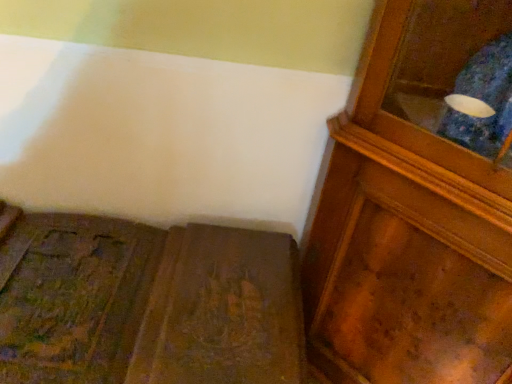
Question: Based on their positions, is wooden cabinet at right located to the left or right of wooden carved bench at lower left?

Choices:
 (A) left
 (B) right

Answer: (B)

Question: Relative to wooden carved bench at lower left, is wooden cabinet at right in front or behind?

Choices:
 (A) front
 (B) behind

Answer: (A)

Question: Is wooden cabinet at right spatially inside wooden carved bench at lower left, or outside of it?

Choices:
 (A) outside
 (B) inside

Answer: (A)

Question: From a real-world perspective, is wooden carved bench at lower left above or below wooden cabinet at right?

Choices:
 (A) above
 (B) below

Answer: (B)

Question: Based on their sizes in the image, would you say wooden carved bench at lower left is bigger or smaller than wooden cabinet at right?

Choices:
 (A) big
 (B) small

Answer: (B)

Question: Is wooden carved bench at lower left taller or shorter than wooden cabinet at right?

Choices:
 (A) short
 (B) tall

Answer: (A)

Question: Considering their positions, is wooden carved bench at lower left located in front of or behind wooden cabinet at right?

Choices:
 (A) front
 (B) behind

Answer: (B)